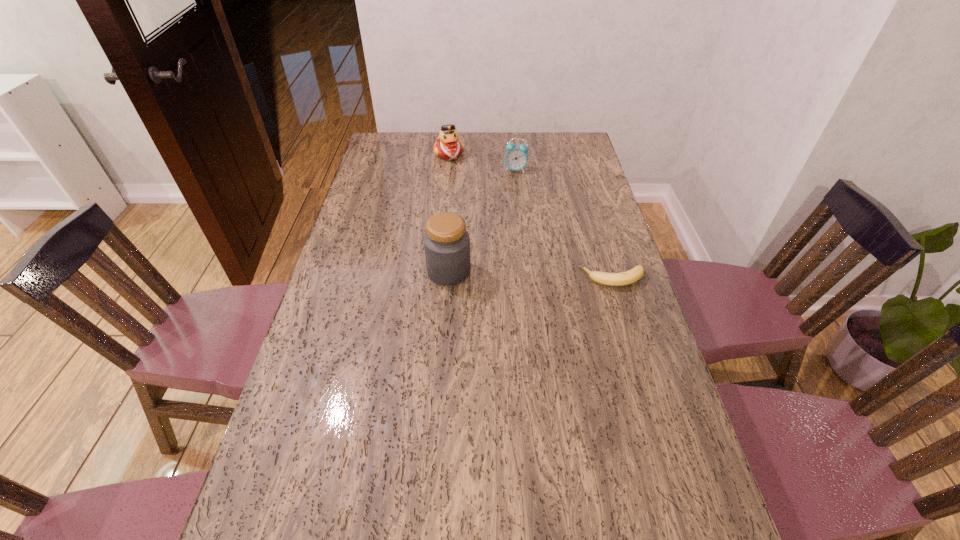
Where is `the tallest object`? the tallest object is located at coordinates (446, 242).

Where is `the rightmost object`? the rightmost object is located at coordinates (625, 278).

Find the location of a particular element. This screenshot has width=960, height=540. banana is located at coordinates (625, 278).

This screenshot has width=960, height=540. I want to click on alarm clock, so click(516, 157).

Find the location of a particular element. the second farthest object is located at coordinates (516, 157).

In order to click on duck in this screenshot , I will do click(x=448, y=147).

Image resolution: width=960 pixels, height=540 pixels. In order to click on free space located on the surface of the tallest object near the warning symbol in this screenshot , I will do `click(354, 272)`.

At what (x,y) coordinates should I click in order to perform the action: click on free space located 0.050m on the surface of the tallest object near the warning symbol. Please return your answer as a coordinate pair (x, y). Looking at the image, I should click on (411, 272).

Locate an element on the screen. blank space located 0.220m on the surface of the tallest object near the warning symbol is located at coordinates coord(354,272).

At what (x,y) coordinates should I click in order to perform the action: click on vacant region located at the stem of the rightmost object. Please return your answer as a coordinate pair (x, y). Looking at the image, I should click on [551, 278].